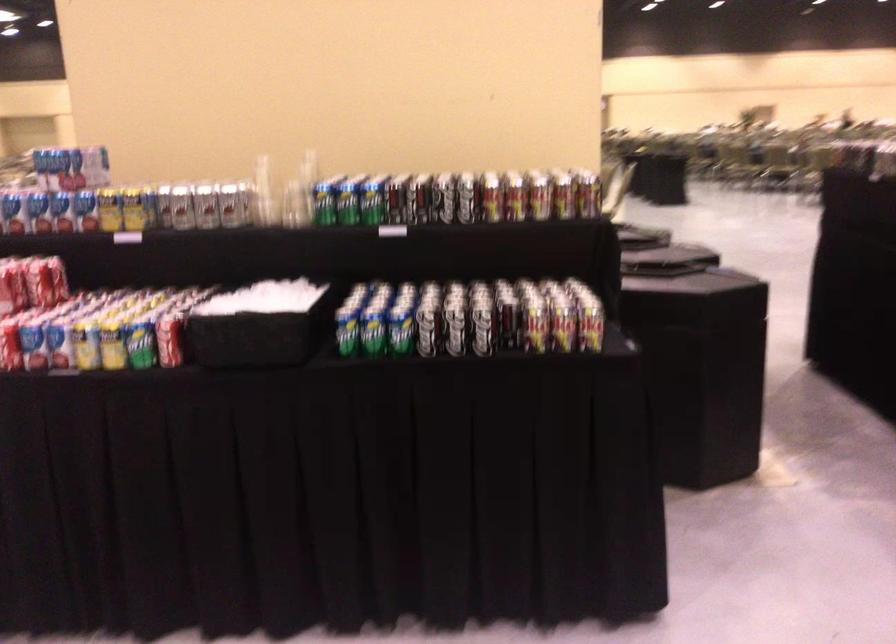
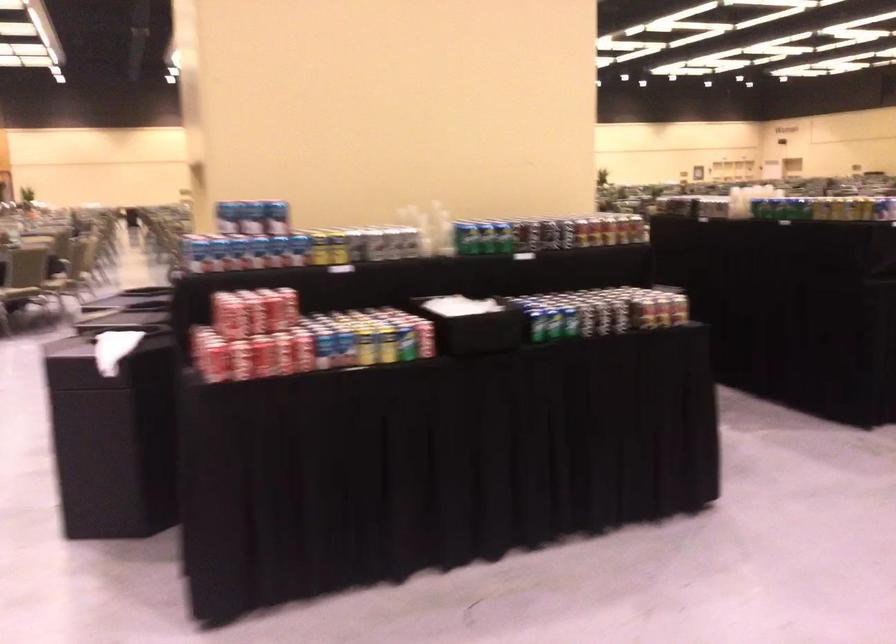
In the second image, find the point that corresponds to point (349, 335) in the first image.

(539, 326)